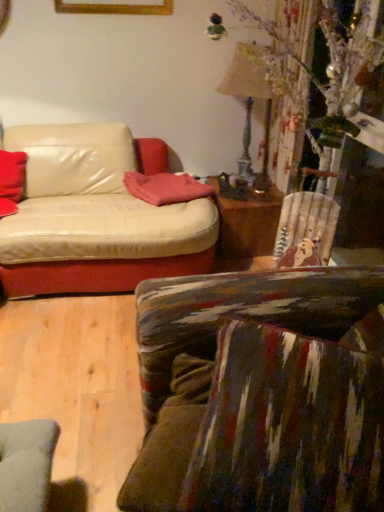
Question: Can you confirm if matte red cushion at left, the first pillow viewed from the left, is bigger than pink fabric pillow at center, which is the 1th pillow from right to left?

Choices:
 (A) yes
 (B) no

Answer: (A)

Question: Is matte red cushion at left, the first pillow viewed from the left, far away from pink fabric pillow at center, positioned as the 2th pillow in left-to-right order?

Choices:
 (A) no
 (B) yes

Answer: (A)

Question: Does matte red cushion at left, the first pillow viewed from the left, appear on the left side of pink fabric pillow at center, which is the 1th pillow from right to left?

Choices:
 (A) yes
 (B) no

Answer: (A)

Question: From a real-world perspective, is matte red cushion at left, the first pillow viewed from the left, located higher than pink fabric pillow at center, which is the 1th pillow from right to left?

Choices:
 (A) yes
 (B) no

Answer: (A)

Question: Can you confirm if matte red cushion at left, arranged as the second pillow when viewed from the right, is wider than pink fabric pillow at center, positioned as the 2th pillow in left-to-right order?

Choices:
 (A) no
 (B) yes

Answer: (B)

Question: Is pink fabric pillow at center, positioned as the 2th pillow in left-to-right order, a part of matte red cushion at left, arranged as the second pillow when viewed from the right?

Choices:
 (A) yes
 (B) no

Answer: (B)

Question: From a real-world perspective, is pink fabric pillow at center, positioned as the 2th pillow in left-to-right order, physically below matte red cushion at left, arranged as the second pillow when viewed from the right?

Choices:
 (A) no
 (B) yes

Answer: (B)

Question: Does pink fabric pillow at center, positioned as the 2th pillow in left-to-right order, come behind matte red cushion at left, arranged as the second pillow when viewed from the right?

Choices:
 (A) yes
 (B) no

Answer: (A)

Question: Are pink fabric pillow at center, which is the 1th pillow from right to left, and matte red cushion at left, arranged as the second pillow when viewed from the right, making contact?

Choices:
 (A) yes
 (B) no

Answer: (B)

Question: Is pink fabric pillow at center, positioned as the 2th pillow in left-to-right order, wider than matte red cushion at left, arranged as the second pillow when viewed from the right?

Choices:
 (A) yes
 (B) no

Answer: (B)

Question: From a real-world perspective, is pink fabric pillow at center, which is the 1th pillow from right to left, over matte red cushion at left, the first pillow viewed from the left?

Choices:
 (A) yes
 (B) no

Answer: (B)

Question: Can you confirm if pink fabric pillow at center, which is the 1th pillow from right to left, is smaller than matte red cushion at left, arranged as the second pillow when viewed from the right?

Choices:
 (A) yes
 (B) no

Answer: (A)

Question: Can you confirm if matte red cushion at left, arranged as the second pillow when viewed from the right, is positioned to the right of wooden table at center?

Choices:
 (A) no
 (B) yes

Answer: (A)